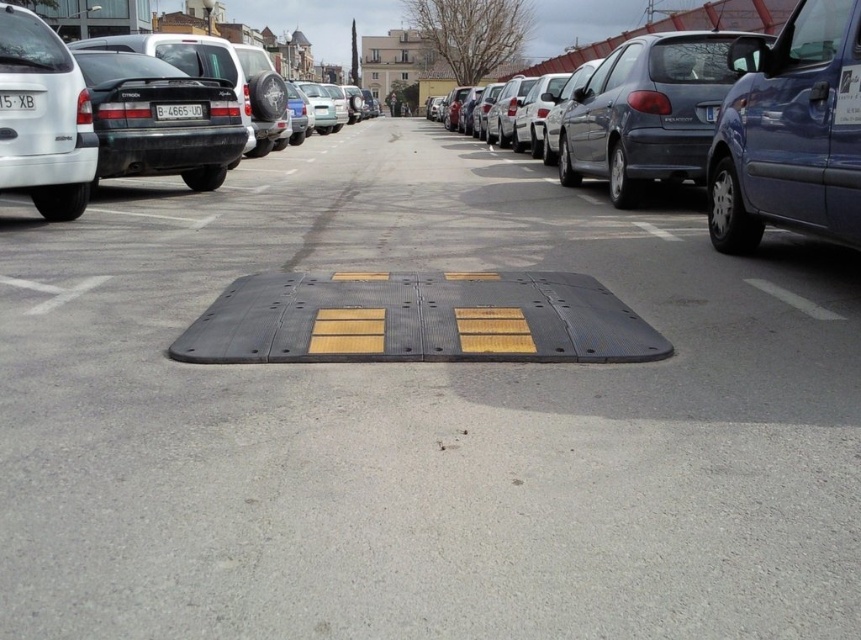
Can you confirm if blue metallic van at right is wider than white plastic license plate at right?

Indeed, blue metallic van at right has a greater width compared to white plastic license plate at right.

Who is shorter, blue metallic van at right or white plastic license plate at right?

white plastic license plate at right

This screenshot has height=640, width=861. I want to click on blue metallic van at right, so click(x=790, y=132).

Is point (790, 301) closer to camera compared to point (172, 113)?

Yes, point (790, 301) is closer to viewer.

In the scene shown: Which of these two, white painted line at center or yellow matte license plate at center, stands taller?

Standing taller between the two is white painted line at center.

Who is more forward, (816, 317) or (170, 108)?

Positioned in front is point (816, 317).

Locate an element on the screen. white painted line at center is located at coordinates (793, 300).

Is point (38, 205) more distant than point (20, 280)?

Yes.

Can you confirm if white matte van at left is positioned below black rubber mat at center?

No, white matte van at left is not below black rubber mat at center.

Does point (40, 180) come in front of point (51, 288)?

No, (40, 180) is further to viewer.

The width and height of the screenshot is (861, 640). I want to click on white matte van at left, so (x=44, y=118).